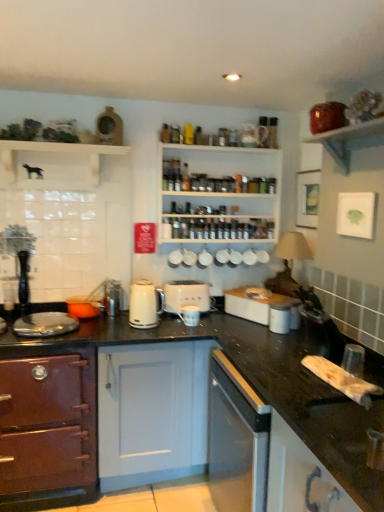
I want to click on vacant space to the left of porcelain matte mug at center, acting as the 2th appliance starting from the right, so click(x=171, y=329).